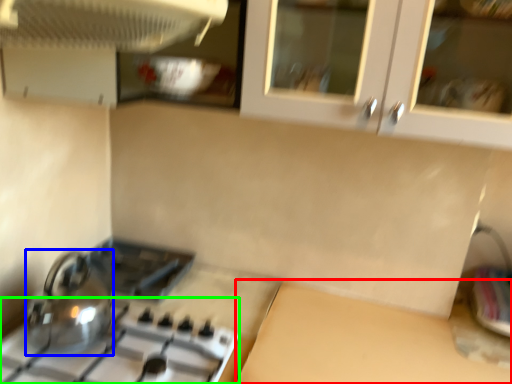
Question: Which object is the closest to the counter top (highlighted by a red box)? Choose among these: kitchen appliance (highlighted by a blue box) or gas stove (highlighted by a green box).

Choices:
 (A) kitchen appliance
 (B) gas stove

Answer: (B)